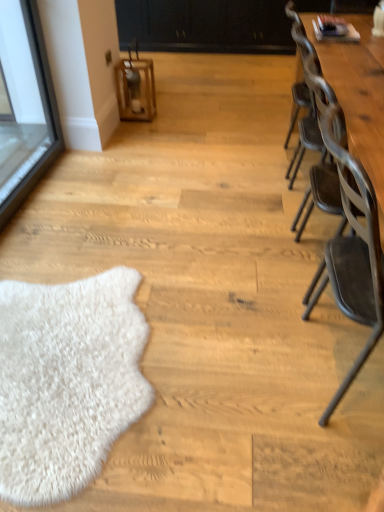
Question: Considering the relative sizes of wooden table at right and metallic gray chair at right in the image provided, is wooden table at right shorter than metallic gray chair at right?

Choices:
 (A) no
 (B) yes

Answer: (B)

Question: From a real-world perspective, is wooden table at right positioned under metallic gray chair at right based on gravity?

Choices:
 (A) yes
 (B) no

Answer: (B)

Question: Would you say wooden table at right is a long distance from metallic gray chair at right?

Choices:
 (A) yes
 (B) no

Answer: (B)

Question: Does wooden table at right have a larger size compared to metallic gray chair at right?

Choices:
 (A) yes
 (B) no

Answer: (A)

Question: Can you confirm if wooden table at right is taller than metallic gray chair at right?

Choices:
 (A) no
 (B) yes

Answer: (A)

Question: Is metallic gray chair at right in front of or behind wooden lantern at center in the image?

Choices:
 (A) behind
 (B) front

Answer: (B)

Question: Looking at the image, does metallic gray chair at right seem bigger or smaller compared to wooden lantern at center?

Choices:
 (A) big
 (B) small

Answer: (A)

Question: From the image's perspective, relative to wooden lantern at center, is metallic gray chair at right above or below?

Choices:
 (A) below
 (B) above

Answer: (A)

Question: Considering the positions of metallic gray chair at right and wooden lantern at center in the image, is metallic gray chair at right wider or thinner than wooden lantern at center?

Choices:
 (A) wide
 (B) thin

Answer: (A)

Question: Considering their positions, is black matte dresser at upper center located in front of or behind wooden lantern at center?

Choices:
 (A) behind
 (B) front

Answer: (A)

Question: From a real-world perspective, relative to wooden lantern at center, is black matte dresser at upper center vertically above or below?

Choices:
 (A) above
 (B) below

Answer: (A)

Question: Would you say black matte dresser at upper center is to the left or to the right of wooden lantern at center in the picture?

Choices:
 (A) left
 (B) right

Answer: (B)

Question: Considering the positions of black matte dresser at upper center and wooden lantern at center in the image, is black matte dresser at upper center wider or thinner than wooden lantern at center?

Choices:
 (A) wide
 (B) thin

Answer: (A)

Question: From a real-world perspective, is black matte dresser at upper center physically located above or below metallic gray chair at right?

Choices:
 (A) below
 (B) above

Answer: (A)

Question: In terms of height, does black matte dresser at upper center look taller or shorter compared to metallic gray chair at right?

Choices:
 (A) short
 (B) tall

Answer: (A)